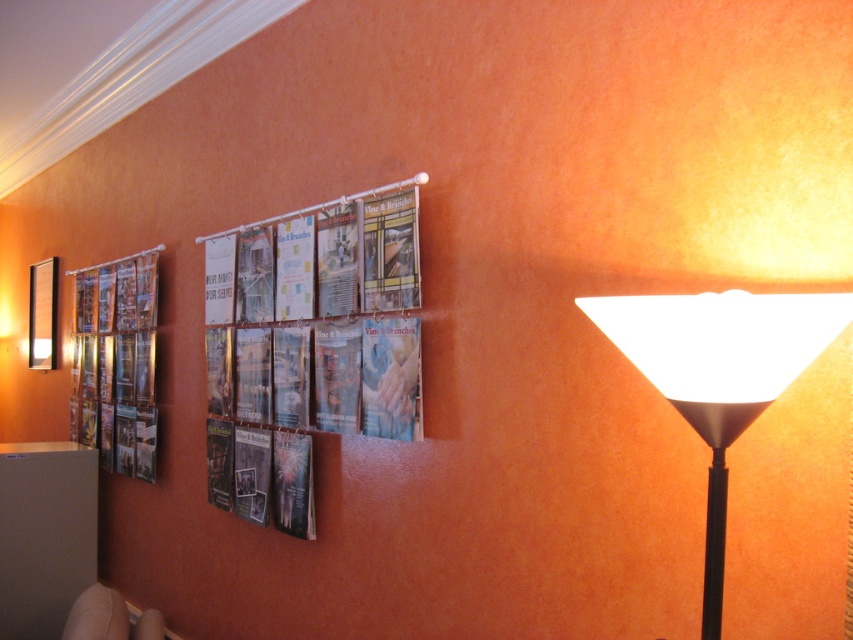
Which is above, matte paper magazine at center or white matte floor lamp at right?

Positioned higher is matte paper magazine at center.

Is matte paper magazine at center smaller than white matte floor lamp at right?

Actually, matte paper magazine at center might be larger than white matte floor lamp at right.

Consider the image. Measure the distance between point (315, 337) and camera.

They are 2.29 meters apart.

Identify the location of matte paper magazine at center. This screenshot has height=640, width=853. (312, 339).

Who is positioned more to the right, matte paper magazine at center or white fabric couch at lower left?

From the viewer's perspective, matte paper magazine at center appears more on the right side.

Is matte paper magazine at center to the right of white fabric couch at lower left from the viewer's perspective?

Yes, matte paper magazine at center is to the right of white fabric couch at lower left.

Is point (285, 250) more distant than point (70, 621)?

Yes, it is behind point (70, 621).

Identify the location of matte paper magazine at center. The image size is (853, 640). (312, 339).

Does metallic glossy poster at left have a lesser height compared to matte black picture frame at left?

No, metallic glossy poster at left is not shorter than matte black picture frame at left.

Is metallic glossy poster at left in front of matte black picture frame at left?

Yes, it is.

Is point (94, 328) positioned behind point (44, 284)?

No, (94, 328) is in front of (44, 284).

What are the coordinates of `metallic glossy poster at left` in the screenshot? It's located at (119, 358).